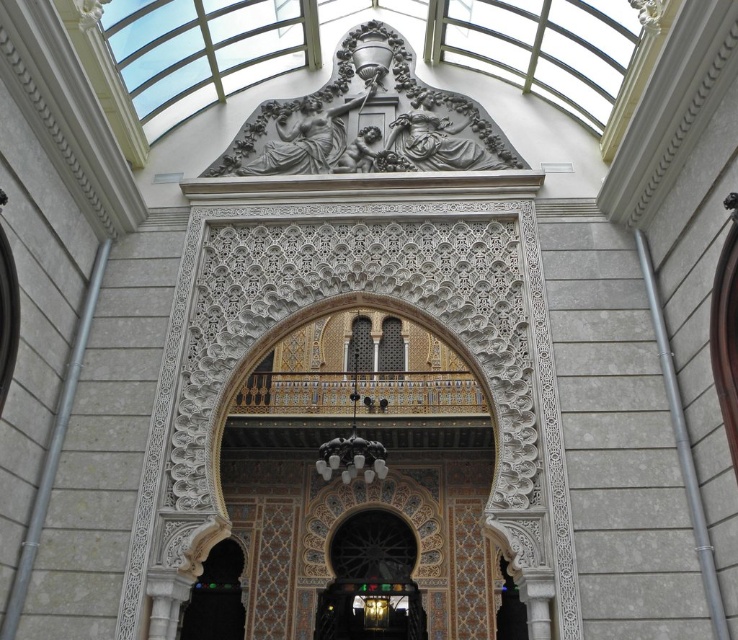
In the scene shown: You are an architect visiting this historical site and need to determine the spatial relationship between the gold mosaic balustrade at center and the dark wood door at lower left. From your vantage point, which object is positioned higher in the image?

The gold mosaic balustrade at center is above the dark wood door at lower left, so it is positioned higher.

You are standing at the camera position looking at the grand archway. There is a point at coordinates point (241, 397). Can you estimate how far this point is from your current position?

The point at (241, 397) is 254.10 feet away from the camera position.